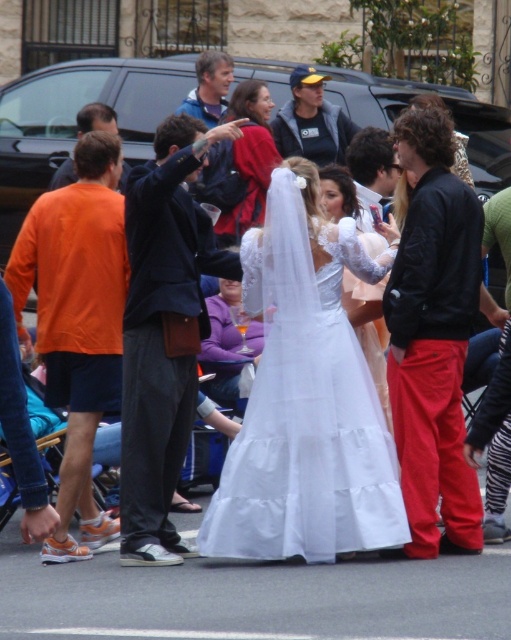
Does dark blue fabric jacket at center lie behind dark gray jacket at upper center?

No, it is not.

Which is in front, point (182, 253) or point (319, 154)?

Positioned in front is point (182, 253).

What do you see at coordinates (164, 332) in the screenshot? The height and width of the screenshot is (640, 511). I see `dark blue fabric jacket at center` at bounding box center [164, 332].

Identify the location of dark blue fabric jacket at center. This screenshot has width=511, height=640. (164, 332).

Does white tulle dress at center have a lesser width compared to white satin dress at center?

Incorrect, white tulle dress at center's width is not less than white satin dress at center's.

Who is more distant from viewer, (240,445) or (380,298)?

The point (380,298) is more distant.

This screenshot has height=640, width=511. I want to click on white tulle dress at center, so click(306, 412).

Does point (113, 280) lie in front of point (501, 218)?

Yes, it is in front of point (501, 218).

Is orange fabric pants at left bigger than red cotton pants at center?

Correct, orange fabric pants at left is larger in size than red cotton pants at center.

Which is in front, point (108, 248) or point (486, 500)?

Point (486, 500) is more forward.

Locate an element on the screen. The image size is (511, 640). orange fabric pants at left is located at coordinates (78, 321).